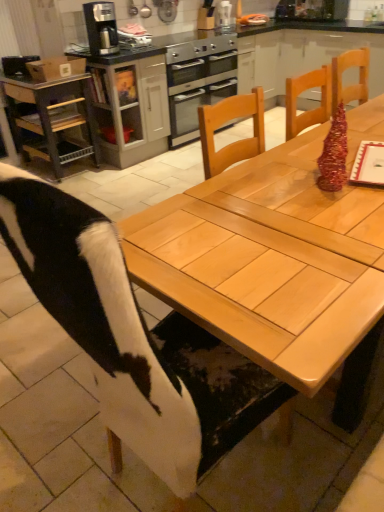
Question: Does stainless steel oven at center have a smaller size compared to metallic gray cart at left?

Choices:
 (A) no
 (B) yes

Answer: (A)

Question: Is the position of stainless steel oven at center more distant than that of metallic gray cart at left?

Choices:
 (A) yes
 (B) no

Answer: (A)

Question: Does stainless steel oven at center have a greater height compared to metallic gray cart at left?

Choices:
 (A) no
 (B) yes

Answer: (A)

Question: Is stainless steel oven at center at the left side of metallic gray cart at left?

Choices:
 (A) no
 (B) yes

Answer: (A)

Question: Is stainless steel oven at center placed right next to metallic gray cart at left?

Choices:
 (A) no
 (B) yes

Answer: (A)

Question: Visually, is metallic silver toaster at upper center positioned to the left or to the right of stainless steel oven at center?

Choices:
 (A) left
 (B) right

Answer: (B)

Question: Is metallic silver toaster at upper center inside the boundaries of stainless steel oven at center, or outside?

Choices:
 (A) outside
 (B) inside

Answer: (A)

Question: From their relative heights in the image, would you say metallic silver toaster at upper center is taller or shorter than stainless steel oven at center?

Choices:
 (A) tall
 (B) short

Answer: (B)

Question: Looking at the image, does metallic silver toaster at upper center seem bigger or smaller compared to stainless steel oven at center?

Choices:
 (A) big
 (B) small

Answer: (B)

Question: From the image's perspective, is metallic gray cart at left positioned above or below satin black coffee maker at upper left?

Choices:
 (A) above
 (B) below

Answer: (B)

Question: Considering their positions, is metallic gray cart at left located in front of or behind satin black coffee maker at upper left?

Choices:
 (A) front
 (B) behind

Answer: (B)

Question: Is point (34, 132) positioned closer to the camera than point (112, 48)?

Choices:
 (A) closer
 (B) farther

Answer: (B)

Question: From a real-world perspective, relative to satin black coffee maker at upper left, is metallic gray cart at left vertically above or below?

Choices:
 (A) below
 (B) above

Answer: (A)

Question: Considering their positions, is stainless steel oven at center located in front of or behind metallic gray cart at left?

Choices:
 (A) behind
 (B) front

Answer: (A)

Question: Based on their positions, is stainless steel oven at center located to the left or right of metallic gray cart at left?

Choices:
 (A) left
 (B) right

Answer: (B)